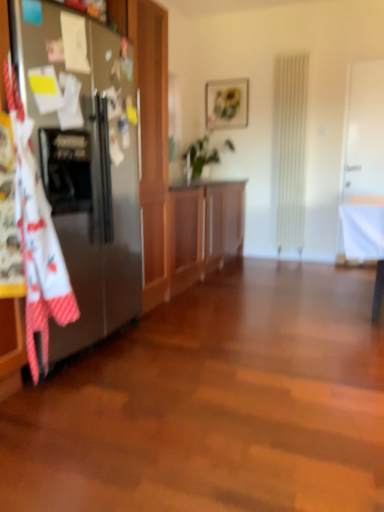
Question: Can you confirm if wooden cabinet at center is positioned to the left of satin silver refrigerator at left?

Choices:
 (A) yes
 (B) no

Answer: (B)

Question: Does wooden cabinet at center appear on the right side of satin silver refrigerator at left?

Choices:
 (A) no
 (B) yes

Answer: (B)

Question: Could you tell me if wooden cabinet at center is facing satin silver refrigerator at left?

Choices:
 (A) no
 (B) yes

Answer: (A)

Question: Considering the relative sizes of wooden cabinet at center and satin silver refrigerator at left in the image provided, is wooden cabinet at center shorter than satin silver refrigerator at left?

Choices:
 (A) yes
 (B) no

Answer: (A)

Question: From the image's perspective, would you say wooden cabinet at center is shown under satin silver refrigerator at left?

Choices:
 (A) no
 (B) yes

Answer: (B)

Question: Is wooden cabinet at center positioned behind satin silver refrigerator at left?

Choices:
 (A) no
 (B) yes

Answer: (B)

Question: Considering the relative positions of green leafy plant at center and satin silver refrigerator at left in the image provided, is green leafy plant at center behind satin silver refrigerator at left?

Choices:
 (A) yes
 (B) no

Answer: (A)

Question: From the image's perspective, is green leafy plant at center over satin silver refrigerator at left?

Choices:
 (A) no
 (B) yes

Answer: (B)

Question: Is green leafy plant at center shorter than satin silver refrigerator at left?

Choices:
 (A) yes
 (B) no

Answer: (A)

Question: Does green leafy plant at center have a greater width compared to satin silver refrigerator at left?

Choices:
 (A) no
 (B) yes

Answer: (A)

Question: Considering the relative sizes of green leafy plant at center and satin silver refrigerator at left in the image provided, is green leafy plant at center smaller than satin silver refrigerator at left?

Choices:
 (A) no
 (B) yes

Answer: (B)

Question: From a real-world perspective, is green leafy plant at center located higher than satin silver refrigerator at left?

Choices:
 (A) no
 (B) yes

Answer: (B)

Question: Does green leafy plant at center have a lesser height compared to matte wooden picture frame at upper center?

Choices:
 (A) no
 (B) yes

Answer: (A)